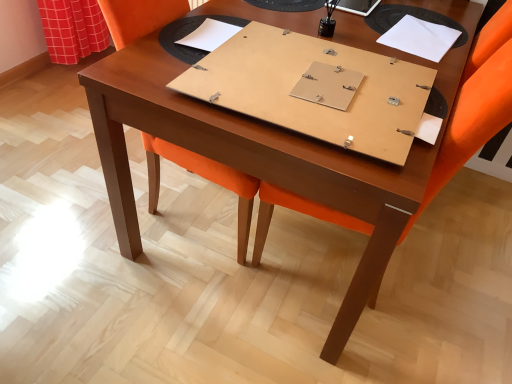
Question: Does orange fabric swivel chair at center have a lesser width compared to white paper at upper right, which is the 1th notebook from right to left?

Choices:
 (A) yes
 (B) no

Answer: (B)

Question: Does orange fabric swivel chair at center come behind white paper at upper right, which is the 1th notebook from right to left?

Choices:
 (A) yes
 (B) no

Answer: (B)

Question: From a real-world perspective, is orange fabric swivel chair at center over white paper at upper right, which is the 1th notebook from right to left?

Choices:
 (A) yes
 (B) no

Answer: (B)

Question: Is orange fabric swivel chair at center not within white paper at upper right, acting as the 3th notebook starting from the left?

Choices:
 (A) no
 (B) yes

Answer: (B)

Question: Does orange fabric swivel chair at center appear on the left side of white paper at upper right, acting as the 3th notebook starting from the left?

Choices:
 (A) yes
 (B) no

Answer: (A)

Question: In terms of width, does orange fabric chair at center look wider or thinner when compared to matte wood notebook at center, positioned as the 2th notebook in right-to-left order?

Choices:
 (A) wide
 (B) thin

Answer: (B)

Question: In terms of height, does orange fabric chair at center look taller or shorter compared to matte wood notebook at center, positioned as the 2th notebook in right-to-left order?

Choices:
 (A) short
 (B) tall

Answer: (B)

Question: From a real-world perspective, is orange fabric chair at center positioned above or below matte wood notebook at center, which is the 2th notebook from left to right?

Choices:
 (A) below
 (B) above

Answer: (A)

Question: From the image's perspective, is orange fabric chair at center positioned above or below matte wood notebook at center, which is the 2th notebook from left to right?

Choices:
 (A) above
 (B) below

Answer: (B)

Question: Is matte wood notebook at center, positioned as the 2th notebook in right-to-left order, inside the boundaries of white cardboard notebook at upper center, marked as the first notebook in a left-to-right arrangement, or outside?

Choices:
 (A) inside
 (B) outside

Answer: (B)

Question: From a real-world perspective, is matte wood notebook at center, which is the 2th notebook from left to right, above or below white cardboard notebook at upper center, marked as the first notebook in a left-to-right arrangement?

Choices:
 (A) below
 (B) above

Answer: (B)

Question: Is matte wood notebook at center, which is the 2th notebook from left to right, bigger or smaller than white cardboard notebook at upper center, marked as the first notebook in a left-to-right arrangement?

Choices:
 (A) big
 (B) small

Answer: (A)

Question: From their relative heights in the image, would you say matte wood notebook at center, positioned as the 2th notebook in right-to-left order, is taller or shorter than white cardboard notebook at upper center, placed as the 3th notebook when sorted from right to left?

Choices:
 (A) tall
 (B) short

Answer: (A)

Question: In terms of size, does white cardboard notebook at upper center, marked as the first notebook in a left-to-right arrangement, appear bigger or smaller than matte wood notebook at center, which is the 2th notebook from left to right?

Choices:
 (A) big
 (B) small

Answer: (B)

Question: In terms of width, does white cardboard notebook at upper center, placed as the 3th notebook when sorted from right to left, look wider or thinner when compared to matte wood notebook at center, which is the 2th notebook from left to right?

Choices:
 (A) wide
 (B) thin

Answer: (B)